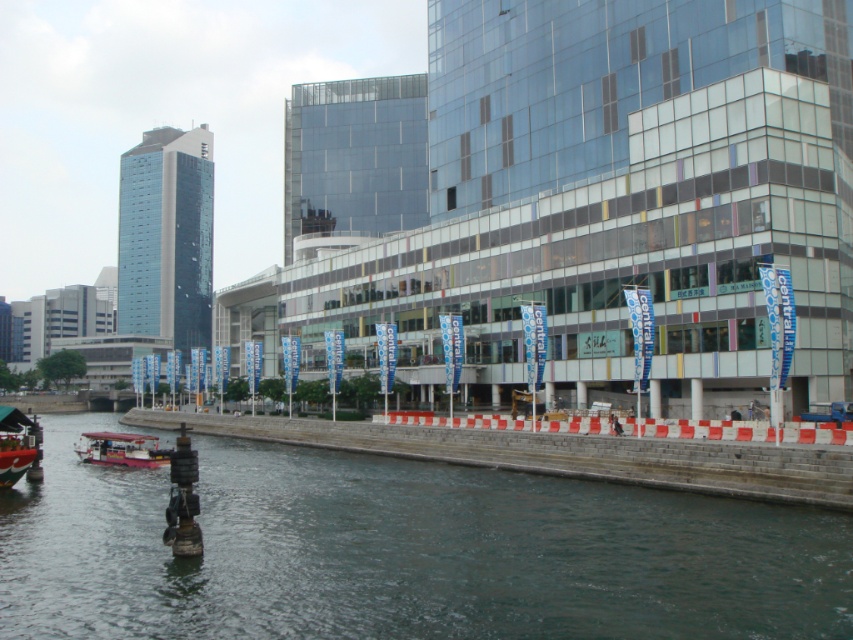
You are a photographer wanting to capture both the red plastic boat at lower left and the pink plastic boat at lower left in a single shot. Which boat should you focus on first to ensure both are in frame?

The red plastic boat at lower left is not as tall as the pink plastic boat at lower left, so you should focus on the pink plastic boat at lower left first to ensure both are in frame.